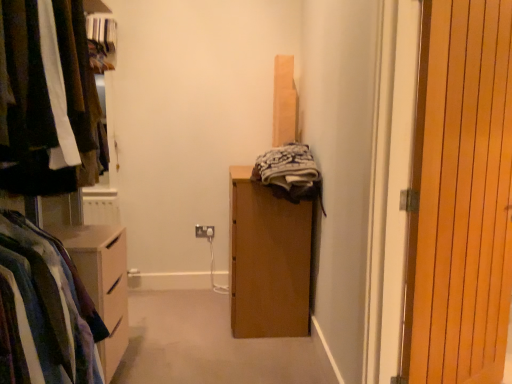
Question: Is matte black clothes at left not near white plastic electric outlet at center?

Choices:
 (A) yes
 (B) no

Answer: (A)

Question: Does matte black clothes at left appear on the right side of white plastic electric outlet at center?

Choices:
 (A) yes
 (B) no

Answer: (B)

Question: From the image's perspective, is matte black clothes at left beneath white plastic electric outlet at center?

Choices:
 (A) no
 (B) yes

Answer: (A)

Question: Can you confirm if matte black clothes at left is taller than white plastic electric outlet at center?

Choices:
 (A) no
 (B) yes

Answer: (B)

Question: Does matte black clothes at left have a larger size compared to white plastic electric outlet at center?

Choices:
 (A) no
 (B) yes

Answer: (B)

Question: Choose the correct answer: Is striped cotton shirt at left inside white plastic electric outlet at center or outside it?

Choices:
 (A) outside
 (B) inside

Answer: (A)

Question: Looking at the image, does striped cotton shirt at left seem bigger or smaller compared to white plastic electric outlet at center?

Choices:
 (A) big
 (B) small

Answer: (A)

Question: From the image's perspective, is striped cotton shirt at left located above or below white plastic electric outlet at center?

Choices:
 (A) above
 (B) below

Answer: (B)

Question: Looking at their shapes, would you say striped cotton shirt at left is wider or thinner than white plastic electric outlet at center?

Choices:
 (A) thin
 (B) wide

Answer: (B)

Question: Considering the relative positions of striped cotton shirt at left and matte black clothes at left in the image provided, is striped cotton shirt at left to the left or to the right of matte black clothes at left?

Choices:
 (A) left
 (B) right

Answer: (B)

Question: In the image, is striped cotton shirt at left positioned in front of or behind matte black clothes at left?

Choices:
 (A) behind
 (B) front

Answer: (A)

Question: Do you think striped cotton shirt at left is within matte black clothes at left, or outside of it?

Choices:
 (A) outside
 (B) inside

Answer: (A)

Question: From a real-world perspective, is striped cotton shirt at left above or below matte black clothes at left?

Choices:
 (A) above
 (B) below

Answer: (B)

Question: In terms of size, does matte black clothes at left appear bigger or smaller than wooden at right?

Choices:
 (A) small
 (B) big

Answer: (B)

Question: Considering the positions of matte black clothes at left and wooden at right in the image, is matte black clothes at left wider or thinner than wooden at right?

Choices:
 (A) wide
 (B) thin

Answer: (A)